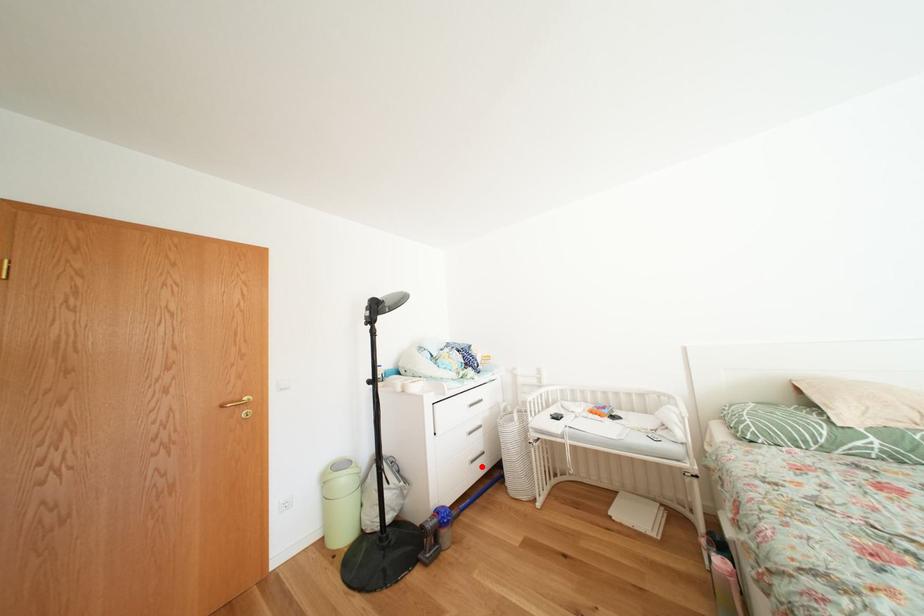
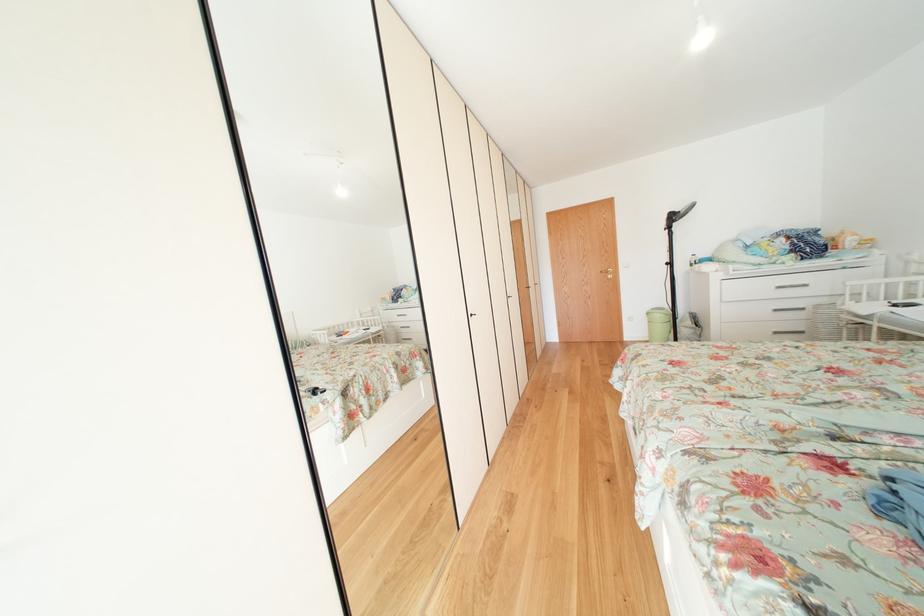
The point at the highlighted location is marked in the first image. Where is the corresponding point in the second image?

(784, 338)